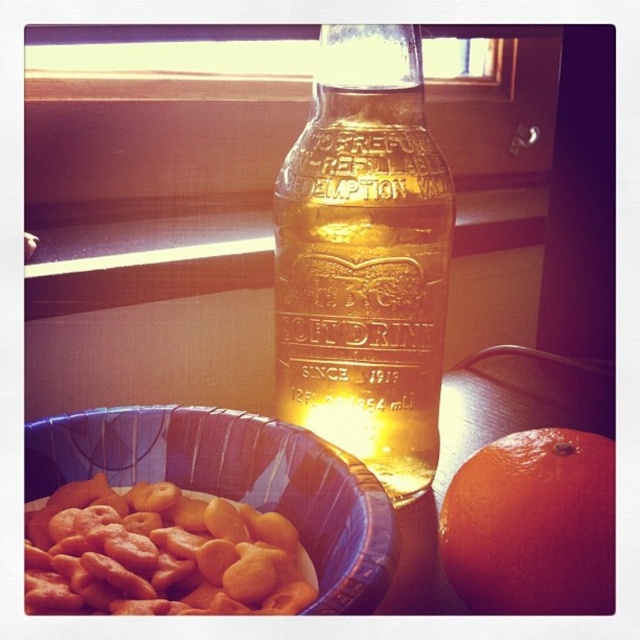
You are arranging snacks on a table and have the golden crispy cereal at lower left and the orange matte at right. If you want to place a new snack between them, where should you put it?

You should place the new snack between the golden crispy cereal at lower left and the orange matte at right since the golden crispy cereal at lower left is to the left of orange matte at right.

You are a delivery person who needs to place a package at point (364, 259). There is a translucent glass bottle at center. Can you place the package there?

There is a translucent glass bottle at center at point (364, 259), so you cannot place the package there.